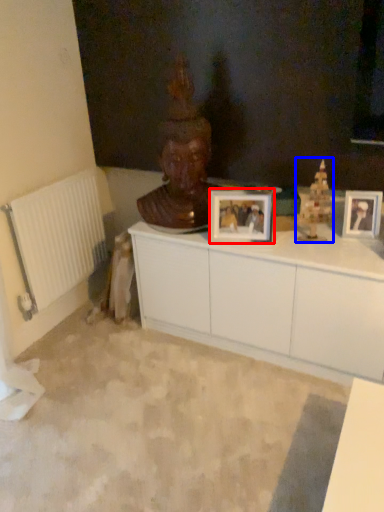
Question: Which object appears closest to the camera in this image, picture frame (highlighted by a red box) or toy (highlighted by a blue box)?

Choices:
 (A) picture frame
 (B) toy

Answer: (B)